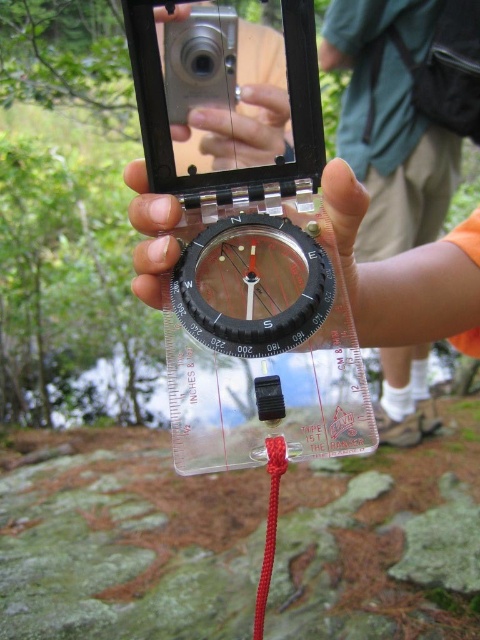
Looking at this image, the scene shows a person holding a compass with a red string attached. There is a point labeled at coordinates [200,60]. What object is located at that point?

The point at coordinates [200,60] corresponds to the silver metallic camera at center.

You are using a clear plastic compass at center to navigate. If you move your hand 2 units to the right, will the compass still be centered in your view?

The clear plastic compass at center is located at point coordinates, so moving your hand 2 units to the right may shift its position in your view depending on the scale of the coordinate system. However, without knowing the coordinate system scale, it is impossible to determine if the compass will remain centered.